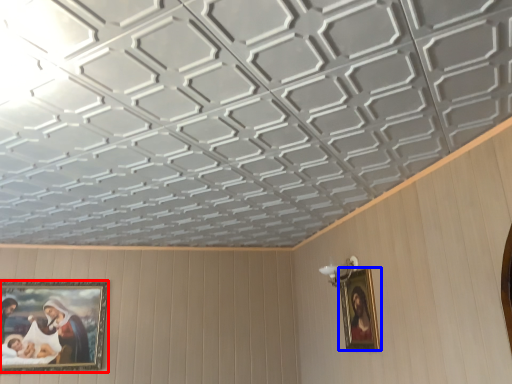
Question: Which object is further to the camera taking this photo, picture frame (highlighted by a red box) or picture frame (highlighted by a blue box)?

Choices:
 (A) picture frame
 (B) picture frame

Answer: (A)